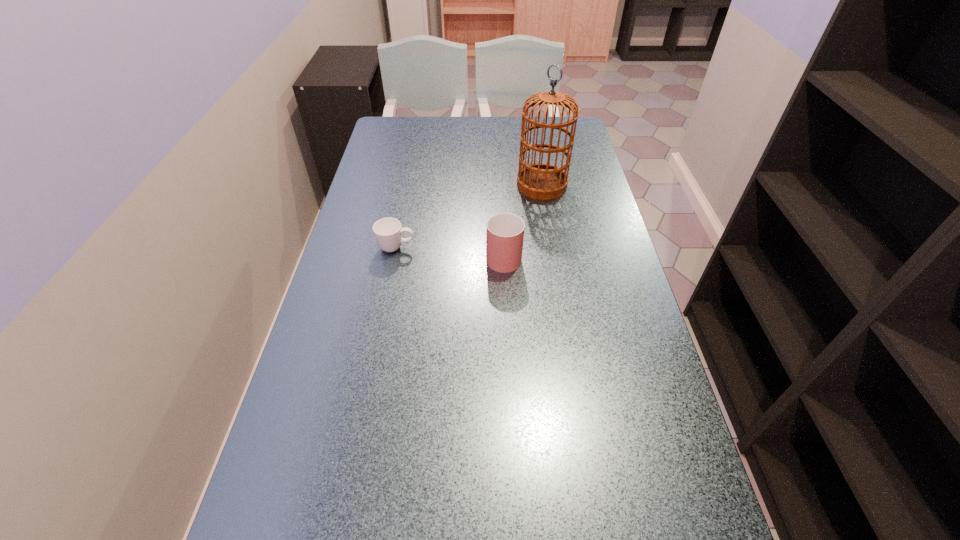
Identify which object is the second closest to the farthest object. Please provide its 2D coordinates. Your answer should be formatted as a tuple, i.e. [(x, y)], where the tuple contains the x and y coordinates of a point satisfying the conditions above.

[(388, 232)]

Locate which object is the second closest to the left cup. Please provide its 2D coordinates. Your answer should be formatted as a tuple, i.e. [(x, y)], where the tuple contains the x and y coordinates of a point satisfying the conditions above.

[(541, 181)]

The height and width of the screenshot is (540, 960). In order to click on free space that satisfies the following two spatial constraints: 1. on the side of the farthest object with the handle; 2. on the right side of the second shortest object in this screenshot , I will do `click(500, 185)`.

Image resolution: width=960 pixels, height=540 pixels. What are the coordinates of `vacant space that satisfies the following two spatial constraints: 1. with the handle on the side of the shortest object; 2. on the side of the right cup with the handle` in the screenshot? It's located at (395, 254).

Identify the location of vacant position in the image that satisfies the following two spatial constraints: 1. on the side of the right cup with the handle; 2. on the right side of the farthest object. (500, 185).

I want to click on free location that satisfies the following two spatial constraints: 1. with the handle on the side of the leftmost object; 2. on the side of the right cup with the handle, so click(395, 254).

You are a GUI agent. You are given a task and a screenshot of the screen. Output one action in this format:
    pyautogui.click(x=<x>, y=<y>)
    Task: Click on the free point that satisfies the following two spatial constraints: 1. on the side of the taller cup with the handle; 2. with the handle on the side of the leftmost object
    Image resolution: width=960 pixels, height=540 pixels.
    Given the screenshot: What is the action you would take?
    [503, 248]

Find the location of a particular element. free space that satisfies the following two spatial constraints: 1. with the handle on the side of the shorter cup; 2. on the side of the right cup with the handle is located at coordinates (395, 254).

Identify the location of vacant space that satisfies the following two spatial constraints: 1. on the side of the second object from right to left with the handle; 2. on the left side of the tallest object. The image size is (960, 540). (500, 185).